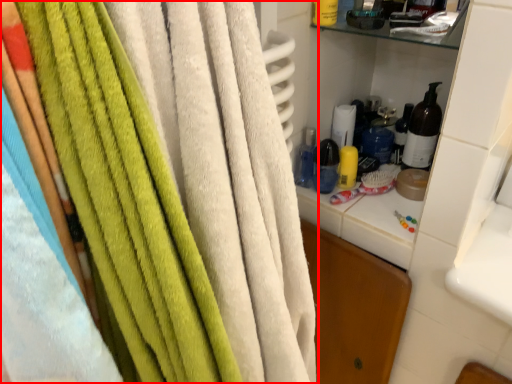
Question: From the image's perspective, considering the relative positions of towel (annotated by the red box) and bottle in the image provided, where is towel (annotated by the red box) located with respect to the staircase?

Choices:
 (A) below
 (B) above

Answer: (A)